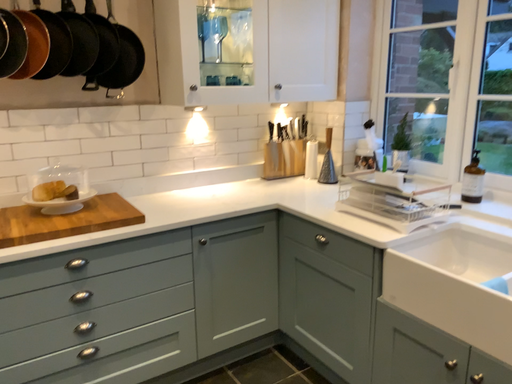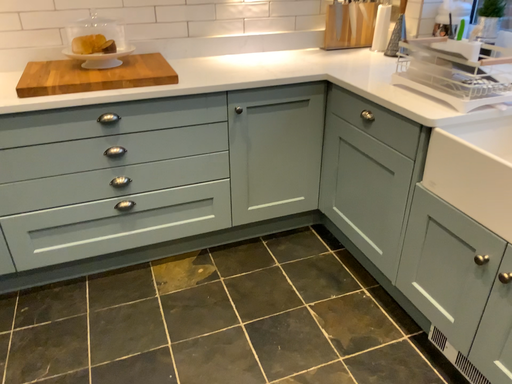
Question: How did the camera likely rotate when shooting the video?

Choices:
 (A) rotated left
 (B) rotated right

Answer: (A)